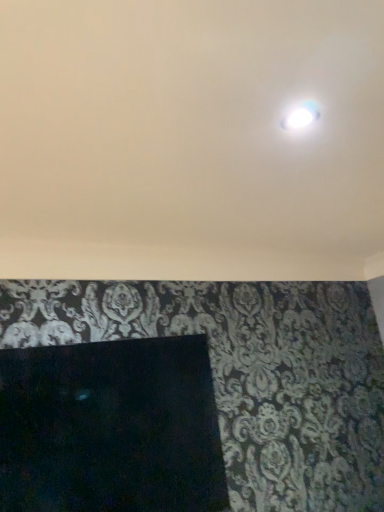
Locate an element on the screen. white glossy droplight at upper center is located at coordinates (301, 116).

Describe the element at coordinates (301, 116) in the screenshot. The height and width of the screenshot is (512, 384). I see `white glossy droplight at upper center` at that location.

The height and width of the screenshot is (512, 384). Find the location of `white glossy droplight at upper center`. white glossy droplight at upper center is located at coordinates (301, 116).